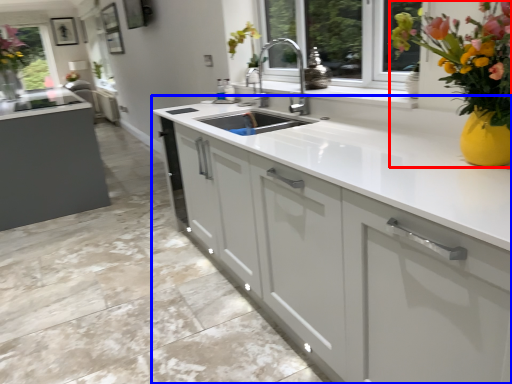
Question: Which object is closer to the camera taking this photo, floral arrangement (highlighted by a red box) or cabinetry (highlighted by a blue box)?

Choices:
 (A) floral arrangement
 (B) cabinetry

Answer: (A)